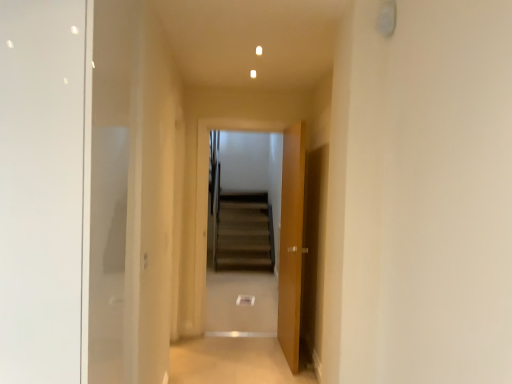
Find the location of a particular element. The width and height of the screenshot is (512, 384). free space to the left of wooden door at center is located at coordinates 246,352.